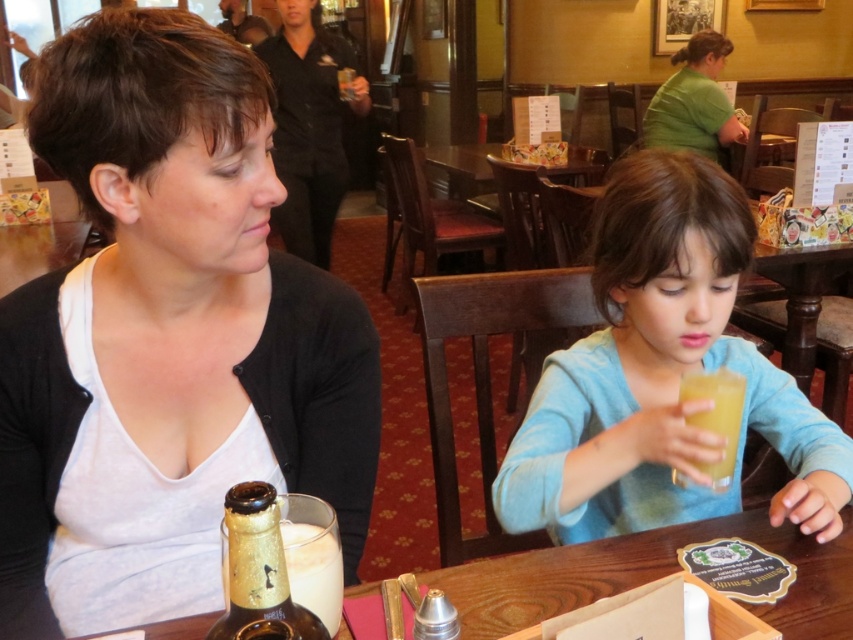
Question: Can you confirm if matte black shirt at center is wider than light blue sweater at center?

Choices:
 (A) yes
 (B) no

Answer: (B)

Question: Does wooden table at center lie in front of green matte shirt at upper right?

Choices:
 (A) yes
 (B) no

Answer: (A)

Question: Is matte black shirt at center to the right of translucent plastic cup at lower center from the viewer's perspective?

Choices:
 (A) no
 (B) yes

Answer: (A)

Question: Which is nearer to the light blue sweater at center?

Choices:
 (A) translucent plastic cup at lower center
 (B) gold metallic bottle at center
 (C) green matte shirt at upper right
 (D) matte black shirt at center

Answer: (A)

Question: Which point appears closest to the camera in this image?

Choices:
 (A) (706, 372)
 (B) (558, 612)

Answer: (B)

Question: Considering the real-world distances, which object is farthest from the wooden table at center?

Choices:
 (A) matte black shirt at center
 (B) translucent plastic cup at lower center

Answer: (A)